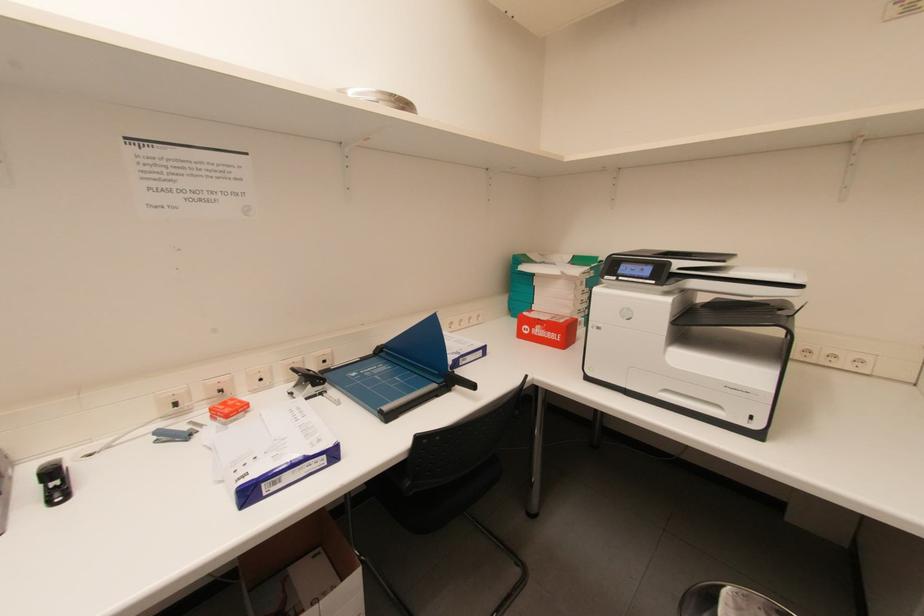
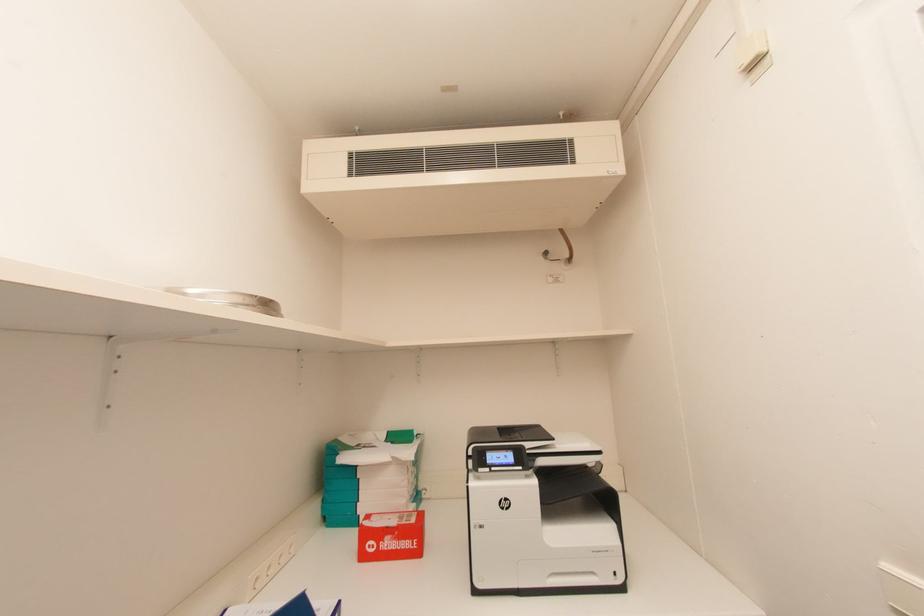
How did the camera likely rotate?

The rotation direction of the camera is right-up.